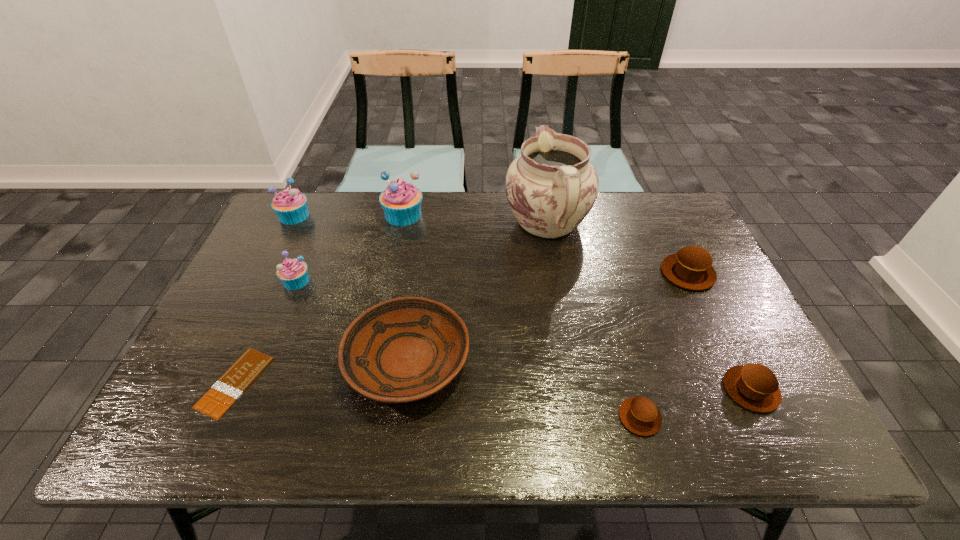
Where is `vacant space at the right edge`? This screenshot has width=960, height=540. vacant space at the right edge is located at coordinates (699, 345).

Where is `free location at the far right corner`? free location at the far right corner is located at coordinates (683, 217).

I want to click on vacant space at the near right corner of the desktop, so click(x=735, y=438).

Where is `empty space between the shortest object and the fifth tallest muffin`? empty space between the shortest object and the fifth tallest muffin is located at coordinates (492, 386).

At what (x,y) coordinates should I click in order to perform the action: click on vacant area between the tallest object and the eighth tallest object. Please return your answer as a coordinate pair (x, y). Image resolution: width=960 pixels, height=540 pixels. Looking at the image, I should click on (593, 321).

You are a GUI agent. You are given a task and a screenshot of the screen. Output one action in this format:
    pyautogui.click(x=<x>, y=<y>)
    Task: Click on the empty location between the third tallest object and the brown plate
    
    Given the screenshot: What is the action you would take?
    pyautogui.click(x=350, y=288)

Identify the location of blank region between the tallest object and the tallest muffin. (475, 220).

Image resolution: width=960 pixels, height=540 pixels. Identify the location of free area in between the pitcher and the eighth shortest object. (475, 220).

Where is `free spot between the second biggest brown muffin and the smallest blue muffin`? free spot between the second biggest brown muffin and the smallest blue muffin is located at coordinates 523,335.

Identify the location of vacant area between the brown plate and the pitcher. (477, 292).